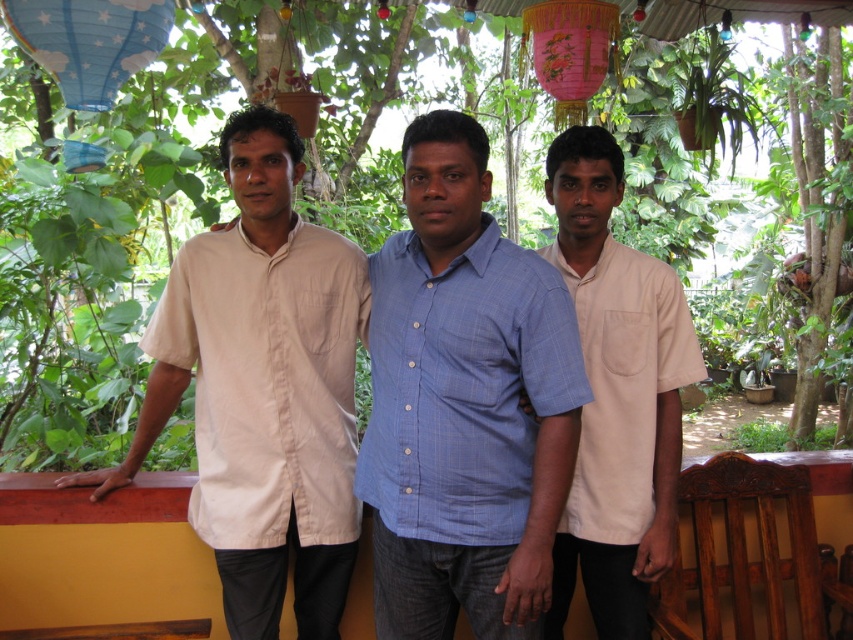
In the scene shown: You are standing at the wooden railing in the image and want to walk towards the point labeled as point (456, 284). Will you pass by the point labeled as point (242, 392) on your way?

Yes, because point (456, 284) is in front of point (242, 392), so you will pass by point (242, 392) on your way to point (456, 284).

You are standing in the garden and notice two people wearing shirts. One is wearing a blue checkered shirt at center and the other a matte white shirt at left. From your perspective, which shirt is positioned to the right?

The blue checkered shirt at center is to the right of the matte white shirt at left.

You are a photographer trying to capture a group photo of the matte white shirt at left and the white cotton shirt at center. Since you want to ensure both subjects are visible, which subject should you position closer to the front of the frame?

The matte white shirt at left should be positioned closer to the front of the frame since it has a lesser height compared to the white cotton shirt at center.